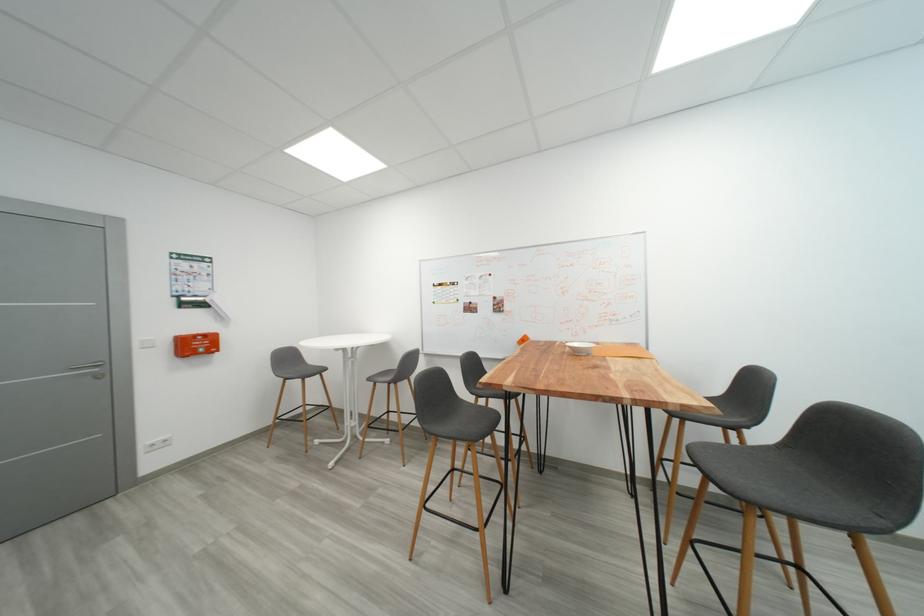
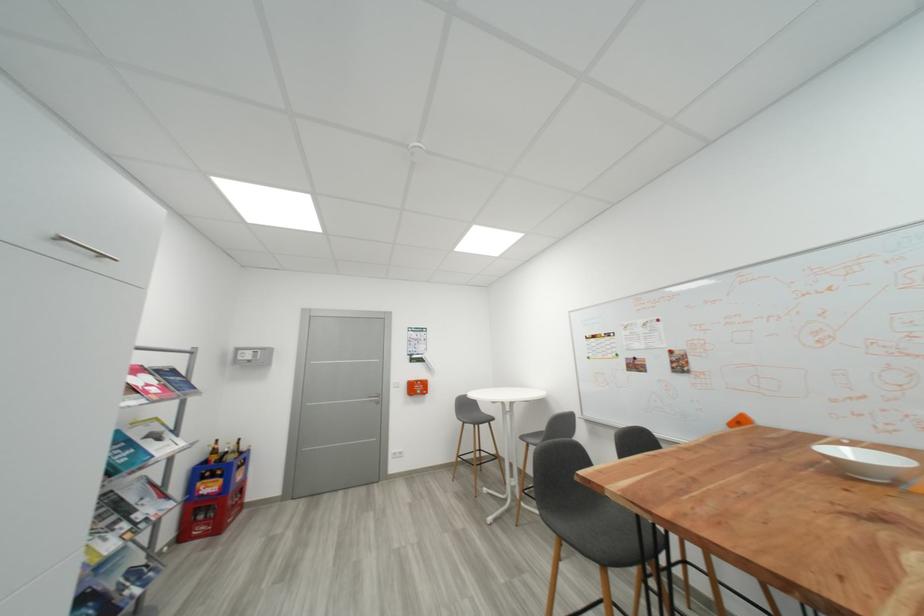
Where in the second image is the point corresponding to (375,381) from the first image?

(528, 439)